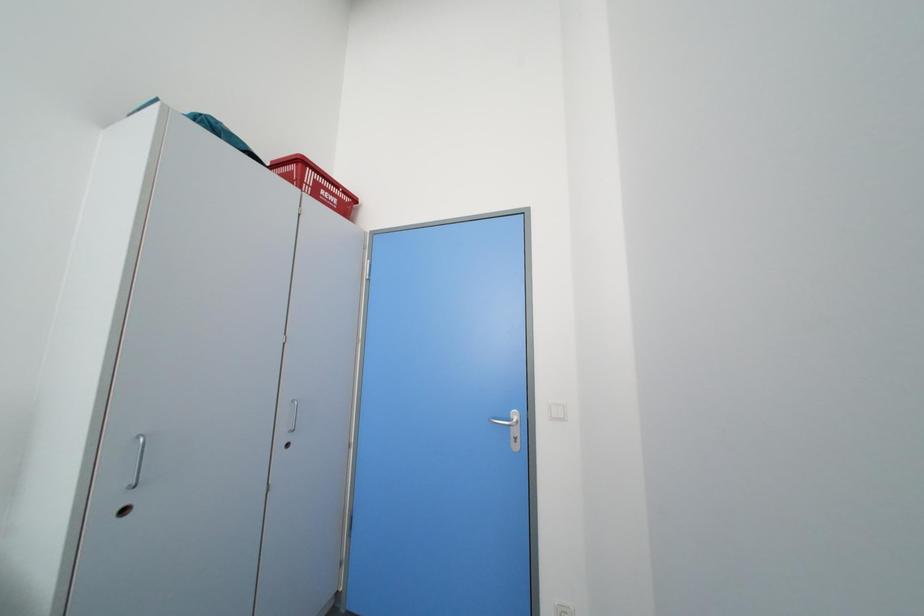
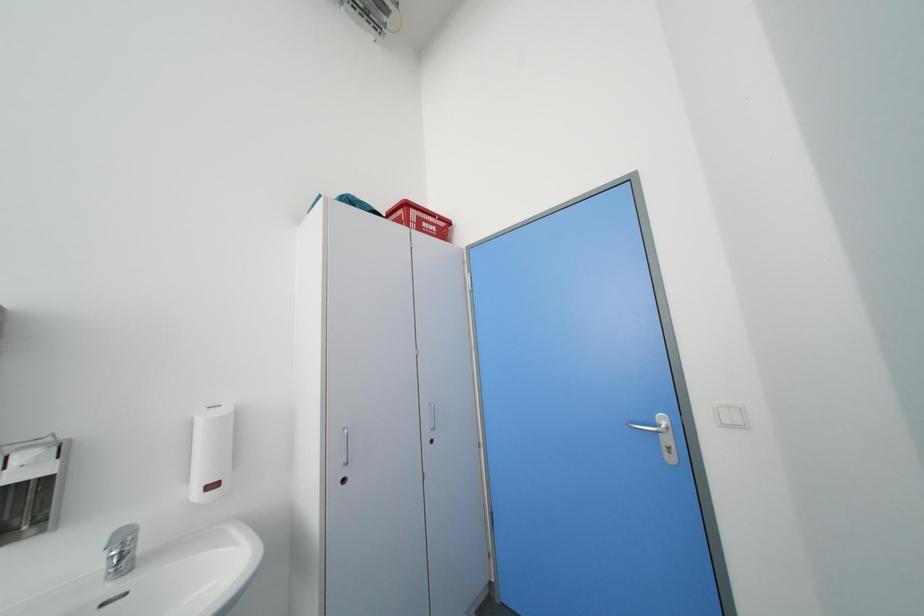
Question: The first image is from the beginning of the video and the second image is from the end. How did the camera likely rotate when shooting the video?

Choices:
 (A) Left
 (B) Right
 (C) Up
 (D) Down

Answer: (A)